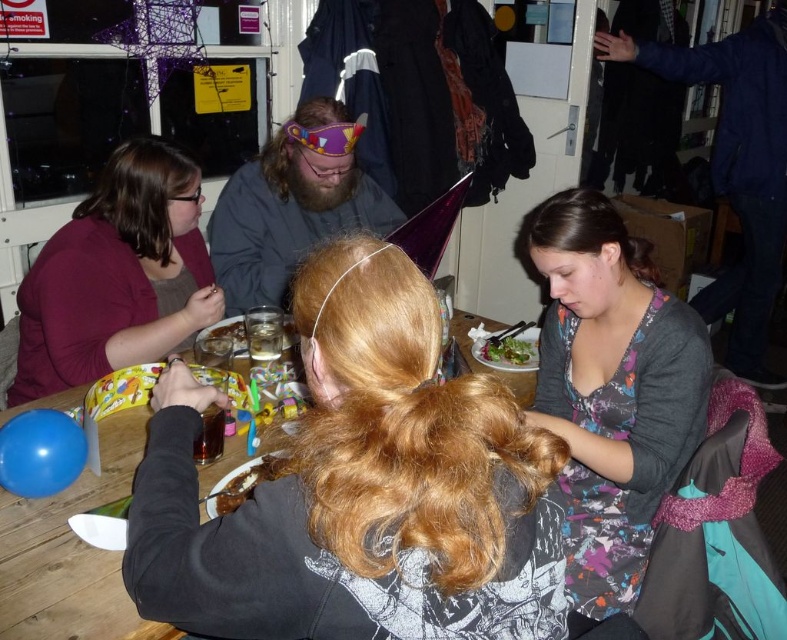
You are a photographer at the event and need to capture a photo where both the floral dress at lower right and the matte purple headband at center are clearly visible. Given their height difference, which object might be partially obscured if you position the camera at a lower angle?

The floral dress at lower right is taller than the matte purple headband at center, so if the camera is positioned at a lower angle, the matte purple headband at center might be partially obscured by the taller floral dress at lower right.

You are planning to wear the floral dress at lower right and the matte purple headband at center together. Based on their sizes, which item might be more challenging to fit into a standard small drawer?

The matte purple headband at center might be more challenging to fit into a standard small drawer since its width is greater than the floral dress at lower right.

You are at the party and want to find the floral dress at lower right. Based on the coordinates given, where should you look relative to the center of the image?

The floral dress at lower right is located at coordinates (612, 388), which is to the right and slightly below the center of the image.